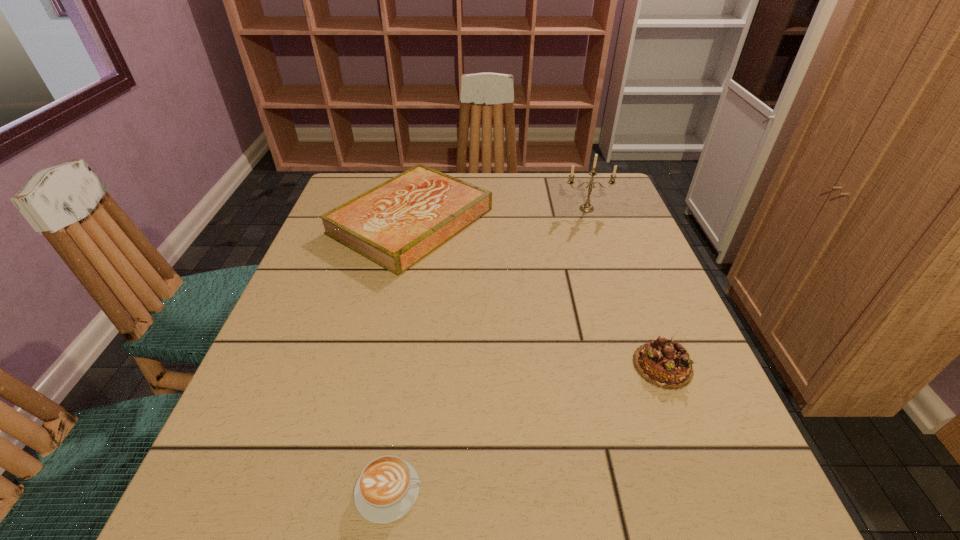
I want to click on candle, so click(587, 207).

At what (x,y) coordinates should I click in order to perform the action: click on hardback book. Please return your answer as a coordinate pair (x, y). Image resolution: width=960 pixels, height=540 pixels. Looking at the image, I should click on (396, 224).

Locate an element on the screen. chocolate cake is located at coordinates (663, 363).

Identify the location of the nearest object. The image size is (960, 540). (387, 488).

Locate an element on the screen. the shortest object is located at coordinates (387, 488).

Where is `vacant space situated on the left of the tallest object`? The height and width of the screenshot is (540, 960). vacant space situated on the left of the tallest object is located at coordinates (422, 209).

The image size is (960, 540). Find the location of `vacant region located on the right of the hardback book`. vacant region located on the right of the hardback book is located at coordinates (569, 221).

Where is `free spot located on the back of the chocolate cake`? The height and width of the screenshot is (540, 960). free spot located on the back of the chocolate cake is located at coordinates (632, 286).

The image size is (960, 540). Identify the location of free space located on the side of the shortest object with the handle. click(x=605, y=490).

You are a GUI agent. You are given a task and a screenshot of the screen. Output one action in this format:
    pyautogui.click(x=<x>, y=<y>)
    Task: Click on the candle located in the far edge section of the desktop
    This screenshot has height=540, width=960.
    Given the screenshot: What is the action you would take?
    pyautogui.click(x=587, y=207)